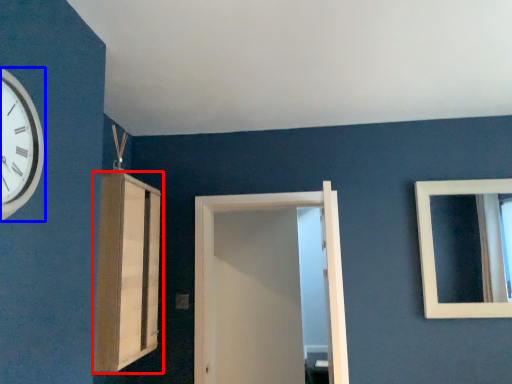
Question: Which point is closer to the camera, cabinetry (highlighted by a red box) or wall clock (highlighted by a blue box)?

Choices:
 (A) cabinetry
 (B) wall clock

Answer: (B)